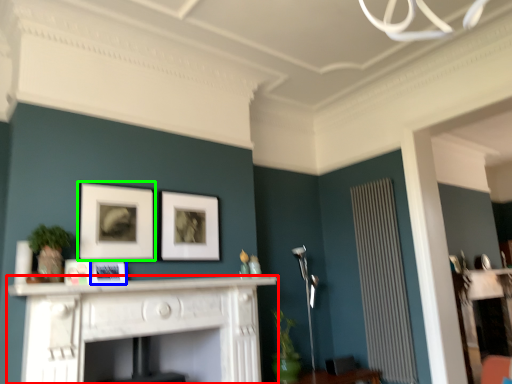
Question: Which is farther away from fireplace (highlighted by a red box)? picture frame (highlighted by a blue box) or picture frame (highlighted by a green box)?

Choices:
 (A) picture frame
 (B) picture frame

Answer: (B)